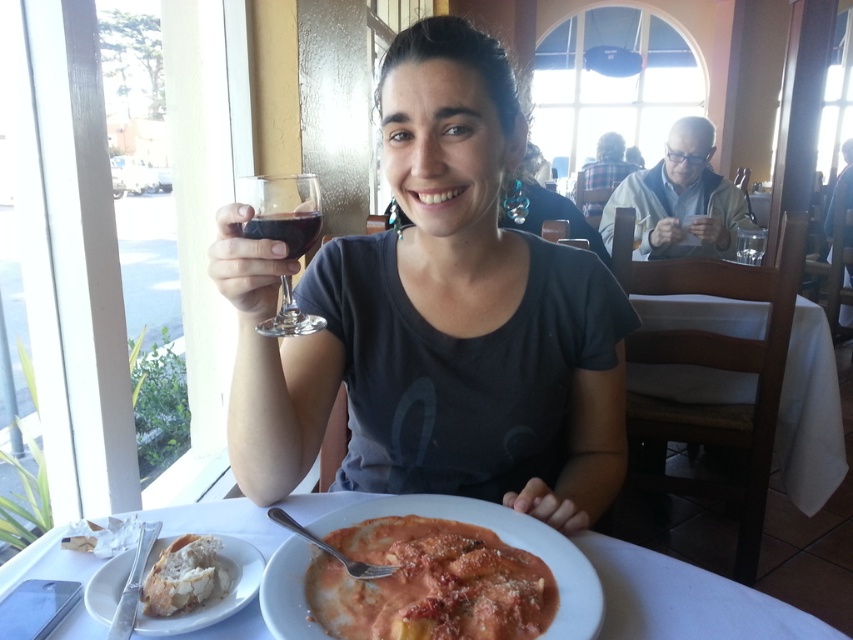
You are a waiter in a restaurant and need to place a new order on the table. The table has the white crusty bread at lower left and the translucent glass wine at upper center. Which item takes up more horizontal space on the table?

The white crusty bread at lower left takes up more horizontal space on the table than the translucent glass wine at upper center because its width surpasses the latter.

You are a customer in a restaurant and want to place your phone on a stable surface near the center of the table. The table has a wooden surface with a checkered pattern. There is a matte glass area at the center. Can you place your phone on the point at coordinates (436, 317)?

The point at coordinates (436, 317) is on matte glass at center, so it is a stable surface and you can place your phone there.

You are a waiter in a restaurant and need to place a new drink order on the table. The table has a matte glass at center and a white glossy plate at lower center. Where should you place the drink to avoid covering any existing items?

You should place the drink on the matte glass at center because the white glossy plate at lower center is behind it, so placing the drink on the matte glass would not cover the plate.